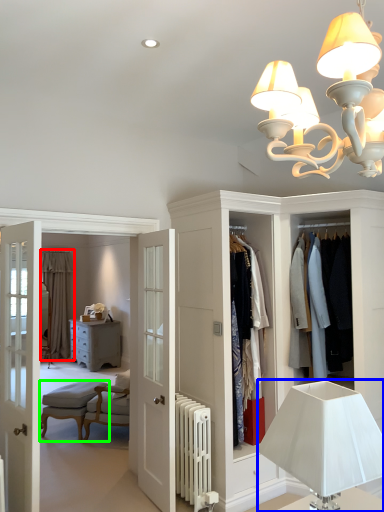
Question: Which object is positioned farthest from curtain (highlighted by a red box)? Select from lamp (highlighted by a blue box) and armchair (highlighted by a green box).

Choices:
 (A) lamp
 (B) armchair

Answer: (A)